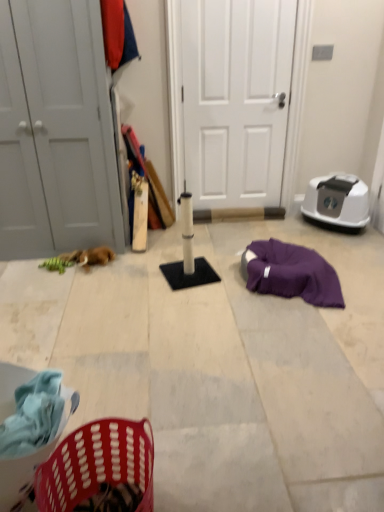
Question: Is white matte door at left, the 1th door positioned from the left, shorter than white matte door at center, the second door when ordered from left to right?

Choices:
 (A) yes
 (B) no

Answer: (B)

Question: From the image's perspective, is white matte door at left, the 1th door positioned from the left, under white matte door at center, the second door when ordered from left to right?

Choices:
 (A) yes
 (B) no

Answer: (A)

Question: Considering the relative positions of white matte door at left, which appears as the 2th door when viewed from the right, and white matte door at center, the second door when ordered from left to right, in the image provided, is white matte door at left, which appears as the 2th door when viewed from the right, to the left of white matte door at center, the second door when ordered from left to right, from the viewer's perspective?

Choices:
 (A) no
 (B) yes

Answer: (B)

Question: Is white matte door at left, the 1th door positioned from the left, not within white matte door at center, the 1th door in the right-to-left sequence?

Choices:
 (A) yes
 (B) no

Answer: (A)

Question: Can you confirm if white matte door at left, the 1th door positioned from the left, is smaller than white matte door at center, the second door when ordered from left to right?

Choices:
 (A) no
 (B) yes

Answer: (A)

Question: Considering the relative positions of white matte door at left, the 1th door positioned from the left, and white matte door at center, the 1th door in the right-to-left sequence, in the image provided, is white matte door at left, the 1th door positioned from the left, in front of white matte door at center, the 1th door in the right-to-left sequence,?

Choices:
 (A) yes
 (B) no

Answer: (A)

Question: Would you say white matte door at center, the second door when ordered from left to right, contains plastic laundry basket at lower left?

Choices:
 (A) yes
 (B) no

Answer: (B)

Question: Is white matte door at center, the 1th door in the right-to-left sequence, looking in the opposite direction of plastic laundry basket at lower left?

Choices:
 (A) yes
 (B) no

Answer: (B)

Question: Is white matte door at center, the second door when ordered from left to right, beside plastic laundry basket at lower left?

Choices:
 (A) no
 (B) yes

Answer: (A)

Question: Does white matte door at center, the second door when ordered from left to right, have a greater height compared to plastic laundry basket at lower left?

Choices:
 (A) yes
 (B) no

Answer: (A)

Question: Is white matte door at center, the second door when ordered from left to right, positioned beyond the bounds of plastic laundry basket at lower left?

Choices:
 (A) no
 (B) yes

Answer: (B)

Question: Is white matte door at center, the second door when ordered from left to right, positioned behind plastic laundry basket at lower left?

Choices:
 (A) yes
 (B) no

Answer: (A)

Question: Does brown plush toy at left have a smaller size compared to plastic laundry basket at lower left?

Choices:
 (A) yes
 (B) no

Answer: (A)